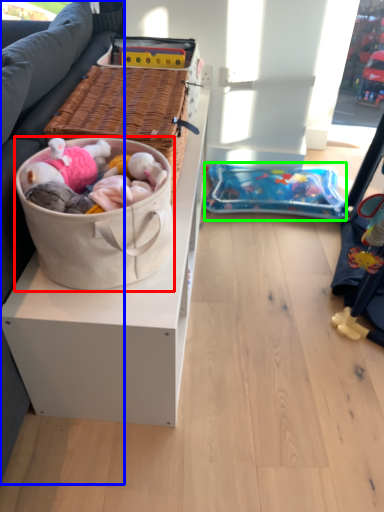
Question: Which object is the farthest from gift basket (highlighted by a red box)? Choose among these: studio couch (highlighted by a blue box) or infant bed (highlighted by a green box).

Choices:
 (A) studio couch
 (B) infant bed

Answer: (B)